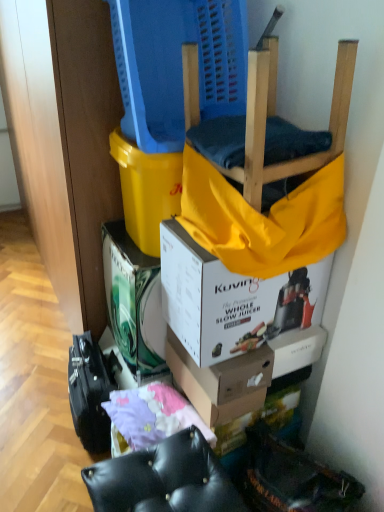
In order to face white cardboard box at center, placed as the second box when sorted from back to front, should I rotate leftwards or rightwards?

It's best to rotate right around 3.921 degrees.

Measure the distance between white cardboard box at center, the second box from the front, and camera.

The distance of white cardboard box at center, the second box from the front, from camera is 1.22 meters.

Find the location of a particular element. This screenshot has width=384, height=512. white cardboard box at upper center, the 3th box viewed from the back is located at coordinates (232, 300).

Does point (331, 256) lie behind point (231, 202)?

Yes, point (331, 256) is behind point (231, 202).

Can you confirm if white cardboard box at upper center, the 3th box viewed from the back, is thinner than yellow fabric at upper center?

Correct, the width of white cardboard box at upper center, the 3th box viewed from the back, is less than that of yellow fabric at upper center.

Is white cardboard box at upper center, the 3th box viewed from the back, touching yellow fabric at upper center?

There is a gap between white cardboard box at upper center, the 3th box viewed from the back, and yellow fabric at upper center.

Measure the distance between white cardboard box at upper center, placed as the 1th box when sorted from front to back, and yellow fabric at upper center.

white cardboard box at upper center, placed as the 1th box when sorted from front to back, is 14.56 centimeters away from yellow fabric at upper center.

Could you tell me if white cardboard box at center, the second box from the front, is facing purple fabric at lower center?

Yes, white cardboard box at center, the second box from the front, is facing purple fabric at lower center.

Between white cardboard box at center, placed as the second box when sorted from back to front, and purple fabric at lower center, which one has less height?

With less height is purple fabric at lower center.

How much distance is there between white cardboard box at center, placed as the second box when sorted from back to front, and purple fabric at lower center?

white cardboard box at center, placed as the second box when sorted from back to front, is 6.19 inches from purple fabric at lower center.

Is white cardboard box at center, the second box from the front, behind purple fabric at lower center?

Yes.

In terms of width, does white cardboard box at upper center, the 3th box viewed from the back, look wider or thinner when compared to white cardboard box at center, the first box from the back?

Clearly, white cardboard box at upper center, the 3th box viewed from the back, has more width compared to white cardboard box at center, the first box from the back.

From a real-world perspective, count 1st boxs downward from the white cardboard box at upper center, placed as the 1th box when sorted from front to back, and point to it. Please provide its 2D coordinates.

[(134, 301)]

Looking at this image, is white cardboard box at upper center, placed as the 1th box when sorted from front to back, positioned with its back to white cardboard box at center, arranged as the third box when viewed from the front?

No, white cardboard box at center, arranged as the third box when viewed from the front, is not at the back of white cardboard box at upper center, placed as the 1th box when sorted from front to back.

From a real-world perspective, is white cardboard box at upper center, placed as the 1th box when sorted from front to back, over white cardboard box at center, arranged as the third box when viewed from the front?

Yes.

From the picture: Can you confirm if purple fabric at lower center is smaller than wooden chair at upper center?

Correct, purple fabric at lower center occupies less space than wooden chair at upper center.

Does purple fabric at lower center turn towards wooden chair at upper center?

No.

From a real-world perspective, who is located higher, purple fabric at lower center or wooden chair at upper center?

wooden chair at upper center is physically above.

Considering the sizes of objects purple fabric at lower center and wooden chair at upper center in the image provided, who is shorter, purple fabric at lower center or wooden chair at upper center?

purple fabric at lower center is shorter.

Measure the distance from yellow fabric at upper center to white cardboard box at center, placed as the second box when sorted from back to front.

The distance of yellow fabric at upper center from white cardboard box at center, placed as the second box when sorted from back to front, is 16.95 inches.

Would you say yellow fabric at upper center contains white cardboard box at center, the second box from the front?

Definitely not — white cardboard box at center, the second box from the front, is not inside yellow fabric at upper center.

Is yellow fabric at upper center oriented away from white cardboard box at center, the second box from the front?

No, yellow fabric at upper center is not facing the opposite direction of white cardboard box at center, the second box from the front.

Does yellow fabric at upper center come in front of white cardboard box at center, the second box from the front?

Yes, the depth of yellow fabric at upper center is less than that of white cardboard box at center, the second box from the front.

Can white cardboard box at center, the second box from the front, be found inside wooden chair at upper center?

No, white cardboard box at center, the second box from the front, is not a part of wooden chair at upper center.

What's the angular difference between wooden chair at upper center and white cardboard box at center, placed as the second box when sorted from back to front,'s facing directions?

wooden chair at upper center and white cardboard box at center, placed as the second box when sorted from back to front, are facing 0.00123 degrees away from each other.

Is wooden chair at upper center not near white cardboard box at center, placed as the second box when sorted from back to front?

That's not correct — wooden chair at upper center is a little close to white cardboard box at center, placed as the second box when sorted from back to front.

Who is bigger, wooden chair at upper center or white cardboard box at center, the second box from the front?

With larger size is wooden chair at upper center.

Which of these two, white cardboard box at center, placed as the second box when sorted from back to front, or white cardboard box at upper center, the 3th box viewed from the back, is wider?

white cardboard box at upper center, the 3th box viewed from the back.

Considering the relative sizes of white cardboard box at center, the second box from the front, and white cardboard box at upper center, placed as the 1th box when sorted from front to back, in the image provided, is white cardboard box at center, the second box from the front, shorter than white cardboard box at upper center, placed as the 1th box when sorted from front to back,?

Indeed, white cardboard box at center, the second box from the front, has a lesser height compared to white cardboard box at upper center, placed as the 1th box when sorted from front to back.

Consider the image. Is the position of white cardboard box at center, the second box from the front, more distant than that of white cardboard box at upper center, the 3th box viewed from the back?

Yes, white cardboard box at center, the second box from the front, is further from the camera.

From the image's perspective, is white cardboard box at center, placed as the second box when sorted from back to front, located above white cardboard box at upper center, placed as the 1th box when sorted from front to back?

No, from the image's perspective, white cardboard box at center, placed as the second box when sorted from back to front, is not over white cardboard box at upper center, placed as the 1th box when sorted from front to back.

Where is `blanket that appears on the right of white cardboard box at upper center, placed as the 1th box when sorted from front to back`? The image size is (384, 512). blanket that appears on the right of white cardboard box at upper center, placed as the 1th box when sorted from front to back is located at coordinates (263, 219).

Identify the location of the 1st box directly above the purple fabric at lower center (from a real-world perspective). (221, 381).

Based on the photo, estimate the real-world distances between objects in this image. Which object is closer to yellow fabric at upper center, white cardboard box at upper center, placed as the 1th box when sorted from front to back, or white cardboard box at center, the first box from the back?

white cardboard box at upper center, placed as the 1th box when sorted from front to back, is positioned closer to the anchor yellow fabric at upper center.

From the image, which object appears to be nearer to white cardboard box at upper center, placed as the 1th box when sorted from front to back, purple fabric at lower center or wooden chair at upper center?

wooden chair at upper center lies closer to white cardboard box at upper center, placed as the 1th box when sorted from front to back, than the other object.

When comparing their distances from purple fabric at lower center, does white cardboard box at center, placed as the second box when sorted from back to front, or wooden chair at upper center seem closer?

The object closer to purple fabric at lower center is white cardboard box at center, placed as the second box when sorted from back to front.

When comparing their distances from white cardboard box at upper center, the 3th box viewed from the back, does white cardboard box at center, arranged as the third box when viewed from the front, or yellow fabric at upper center seem further?

white cardboard box at center, arranged as the third box when viewed from the front, is further to white cardboard box at upper center, the 3th box viewed from the back.

Which object lies further to the anchor point purple fabric at lower center, black leather ottoman at lower center or white cardboard box at center, placed as the second box when sorted from back to front?

black leather ottoman at lower center lies further to purple fabric at lower center than the other object.

Considering their positions, is white cardboard box at center, the second box from the front, positioned further to white cardboard box at center, the first box from the back, than black leather ottoman at lower center?

Based on the image, black leather ottoman at lower center appears to be further to white cardboard box at center, the first box from the back.

Considering their positions, is white cardboard box at center, placed as the second box when sorted from back to front, positioned further to yellow fabric at upper center than purple fabric at lower center?

purple fabric at lower center is further to yellow fabric at upper center.

Based on their spatial positions, is wooden chair at upper center or purple fabric at lower center closer to yellow fabric at upper center?

wooden chair at upper center is closer to yellow fabric at upper center.

Locate an element on the screen. This screenshot has width=384, height=512. box between white cardboard box at upper center, the 3th box viewed from the back, and white cardboard box at center, placed as the second box when sorted from back to front, in the vertical direction is located at coordinates (134, 301).

The image size is (384, 512). Identify the location of blanket between wooden chair at upper center and black leather ottoman at lower center in the vertical direction. (263, 219).

This screenshot has height=512, width=384. Find the location of `blanket that lies between wooden chair at upper center and purple fabric at lower center from top to bottom`. blanket that lies between wooden chair at upper center and purple fabric at lower center from top to bottom is located at coordinates (263, 219).

The height and width of the screenshot is (512, 384). In order to click on material that lies between white cardboard box at center, arranged as the third box when viewed from the front, and black leather ottoman at lower center from top to bottom in this screenshot , I will do `click(150, 417)`.